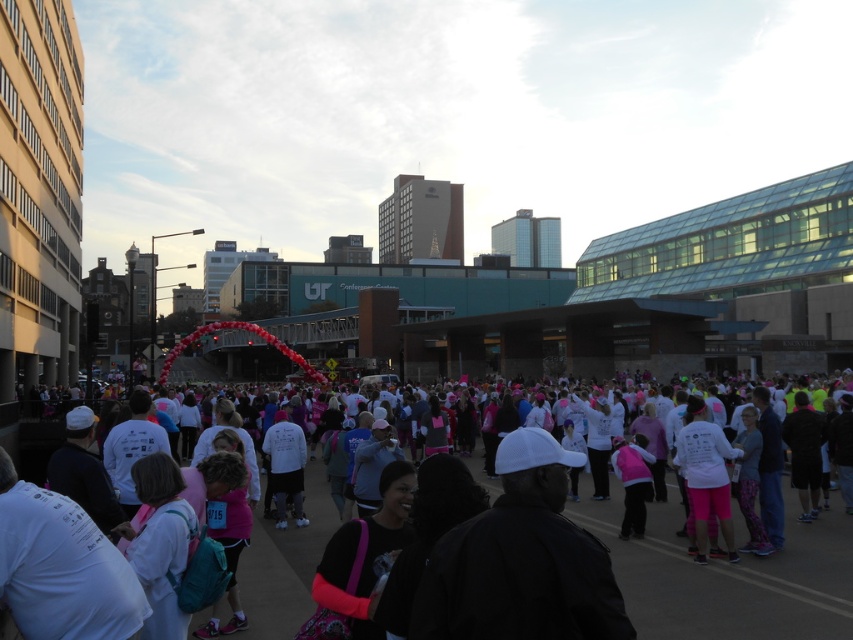
Measure the distance from white matte shirt at center to white matte t-shirt at center.

white matte shirt at center and white matte t-shirt at center are 69.74 feet apart from each other.

Where is `white matte shirt at center`? Image resolution: width=853 pixels, height=640 pixels. white matte shirt at center is located at coordinates (705, 476).

Which is behind, point (676, 554) or point (267, 456)?

Point (267, 456)

From the picture: Which is more to the left, white cotton shirts at center or white matte t-shirt at center?

white matte t-shirt at center

Does point (824, 627) come closer to viewer compared to point (291, 422)?

Yes, it is in front of point (291, 422).

The width and height of the screenshot is (853, 640). Identify the location of white cotton shirts at center. [x=727, y=576].

Is white cotton shirts at center smaller than white matte shirt at center?

No.

Between point (839, 593) and point (700, 460), which one is positioned behind?

Point (700, 460)

Does point (776, 593) lie in front of point (728, 556)?

Yes.

The width and height of the screenshot is (853, 640). I want to click on white cotton shirts at center, so click(x=727, y=576).